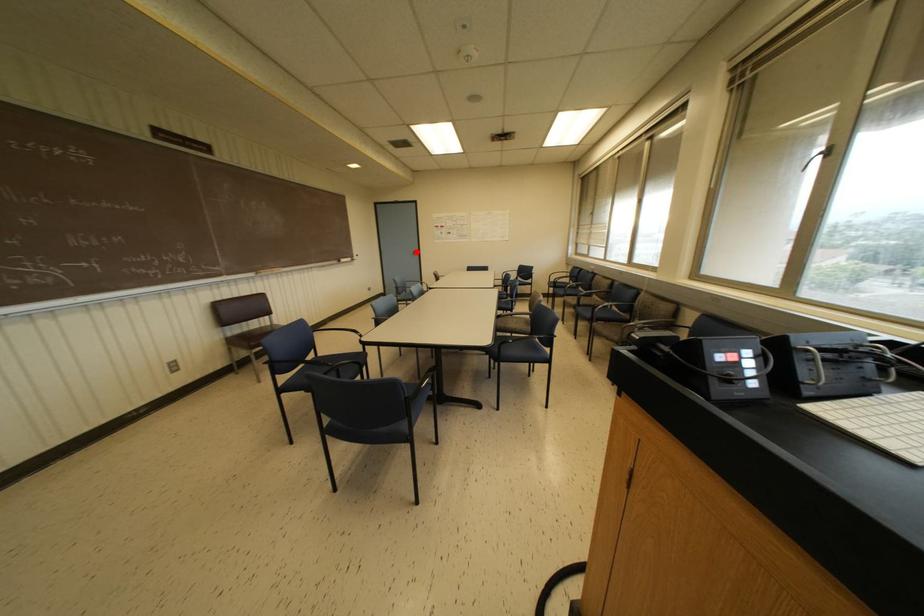
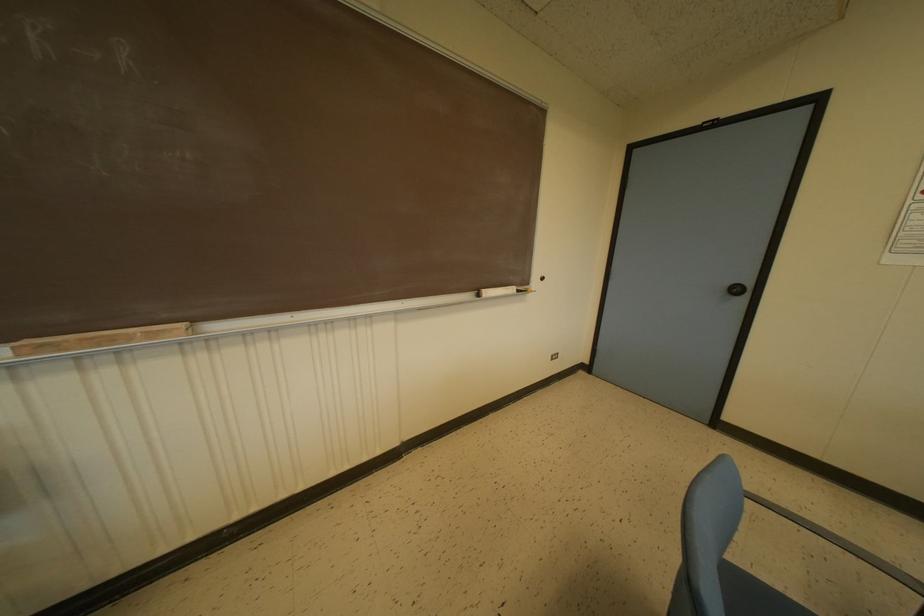
Locate, in the second image, the point that corresponds to the highlighted location in the first image.

(746, 291)